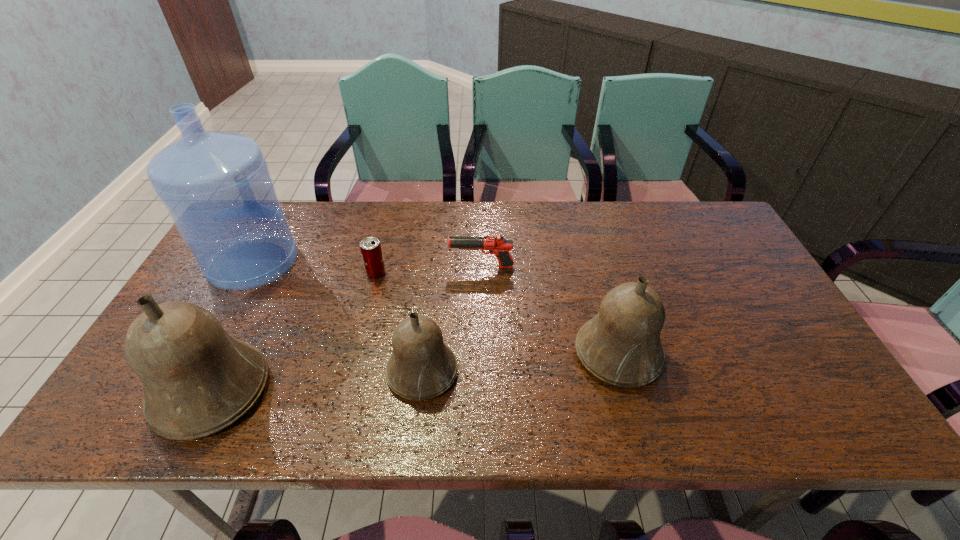
Identify the location of the second tallest object. (198, 379).

Where is `the tallest bell`? The height and width of the screenshot is (540, 960). the tallest bell is located at coordinates (198, 379).

Identify the location of the second bell from right to left. (421, 367).

Find the location of a particular element. the shortest bell is located at coordinates (421, 367).

At what (x,y) coordinates should I click in order to perform the action: click on the rightmost bell. Please return your answer as a coordinate pair (x, y). This screenshot has width=960, height=540. Looking at the image, I should click on (621, 345).

Find the location of a particular element. the rightmost object is located at coordinates (621, 345).

Identify the location of gun. (496, 244).

This screenshot has height=540, width=960. I want to click on water jug, so click(x=216, y=186).

Where is `beer can`? The width and height of the screenshot is (960, 540). beer can is located at coordinates (371, 251).

Where is `blank area located 0.210m on the back of the tallest bell`? The width and height of the screenshot is (960, 540). blank area located 0.210m on the back of the tallest bell is located at coordinates (264, 286).